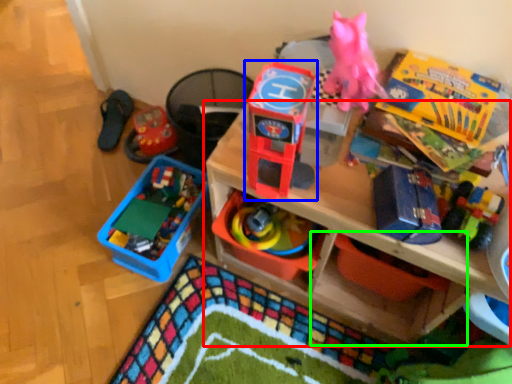
Question: Based on their relative distances, which object is nearer to shelf (highlighted by a red box)? Choose from toy (highlighted by a blue box) and storage box (highlighted by a green box).

Choices:
 (A) toy
 (B) storage box

Answer: (B)